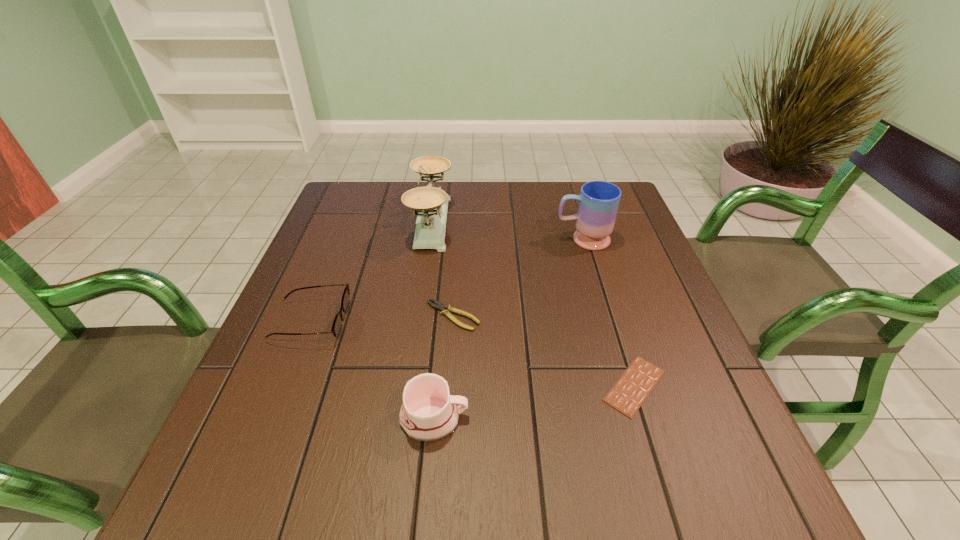
The width and height of the screenshot is (960, 540). In order to click on scale in this screenshot , I will do 430,203.

At what (x,y) coordinates should I click in order to perform the action: click on the right mug. Please return your answer as a coordinate pair (x, y). Looking at the image, I should click on (598, 205).

Locate an element on the screen. The width and height of the screenshot is (960, 540). the second tallest object is located at coordinates (598, 205).

Locate an element on the screen. The width and height of the screenshot is (960, 540). the shorter mug is located at coordinates (428, 413).

The width and height of the screenshot is (960, 540). What are the coordinates of `the fourth shortest object` in the screenshot? It's located at pyautogui.click(x=428, y=413).

I want to click on spectacles, so click(337, 325).

In order to click on the leftmost object in this screenshot , I will do `click(337, 325)`.

Where is `pliers`? pliers is located at coordinates (445, 310).

Locate an element on the screen. The width and height of the screenshot is (960, 540). the shortest object is located at coordinates (627, 395).

Where is `vacant region located 0.250m on the front-facing side of the scale`? The width and height of the screenshot is (960, 540). vacant region located 0.250m on the front-facing side of the scale is located at coordinates point(539,222).